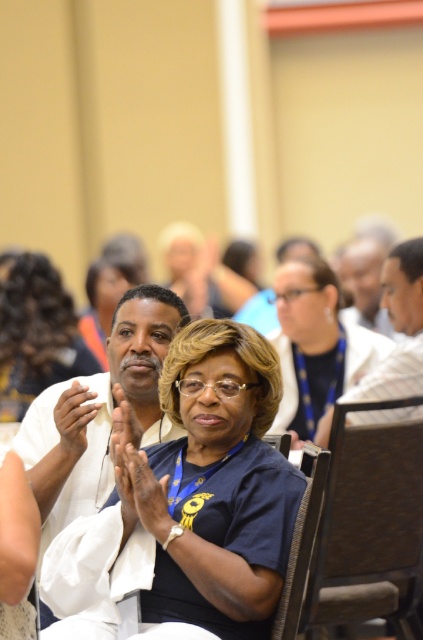
Looking at this image, you are a photographer standing in the conference room and want to take a closeup photo of the white fabric shirt at center. The camera you are using has a minimum focusing distance of 2 meters. Can you take the photo without moving closer?

The white fabric shirt at center is 2.92 meters from the camera, which is beyond the minimum focusing distance of 2 meters. Therefore, you can take the photo without moving closer.